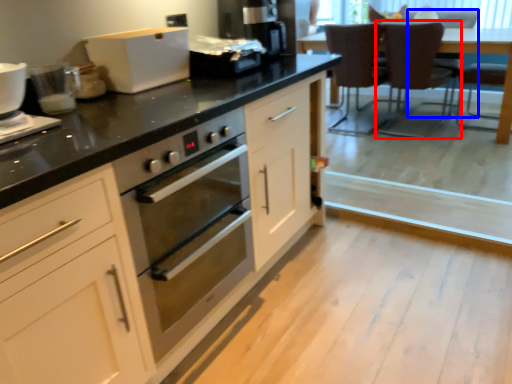
Question: Among these objects, which one is farthest to the camera, chair (highlighted by a red box) or armchair (highlighted by a blue box)?

Choices:
 (A) chair
 (B) armchair

Answer: (B)